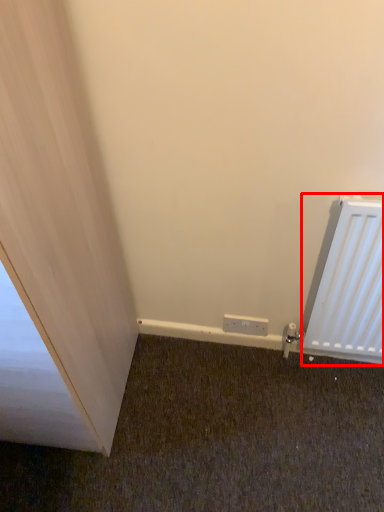
Question: From the image's perspective, what is the correct spatial relationship of radiator (annotated by the red box) in relation to electric outlet?

Choices:
 (A) above
 (B) below

Answer: (A)